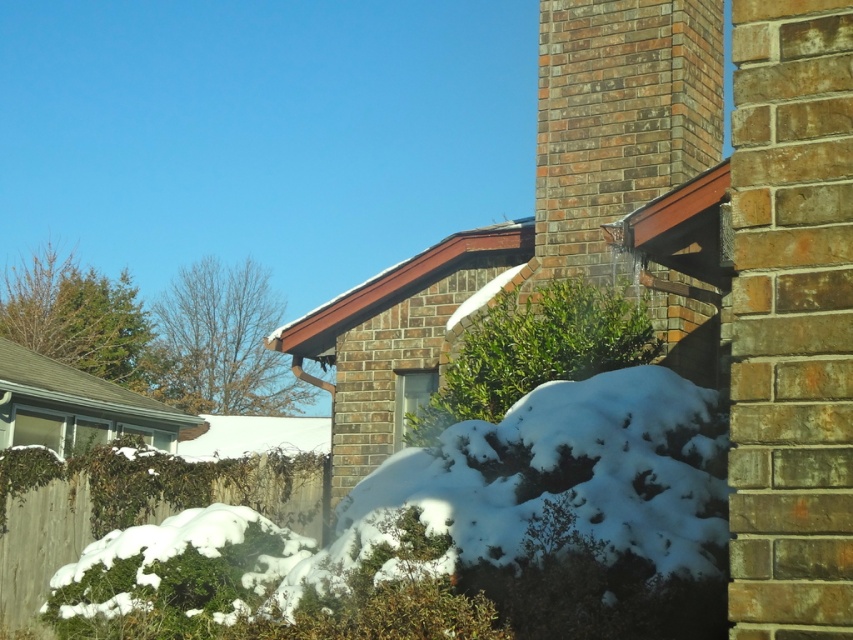
Question: From the image, what is the correct spatial relationship of white fluffy snow at lower center in relation to brick chimney at upper right?

Choices:
 (A) above
 (B) below

Answer: (B)

Question: Which point is closer to the camera?

Choices:
 (A) (700, 461)
 (B) (540, 184)

Answer: (A)

Question: Is white fluffy snow at lower center smaller than brick chimney at upper right?

Choices:
 (A) yes
 (B) no

Answer: (B)

Question: Can you confirm if white fluffy snow at lower center is thinner than brick chimney at upper right?

Choices:
 (A) yes
 (B) no

Answer: (B)